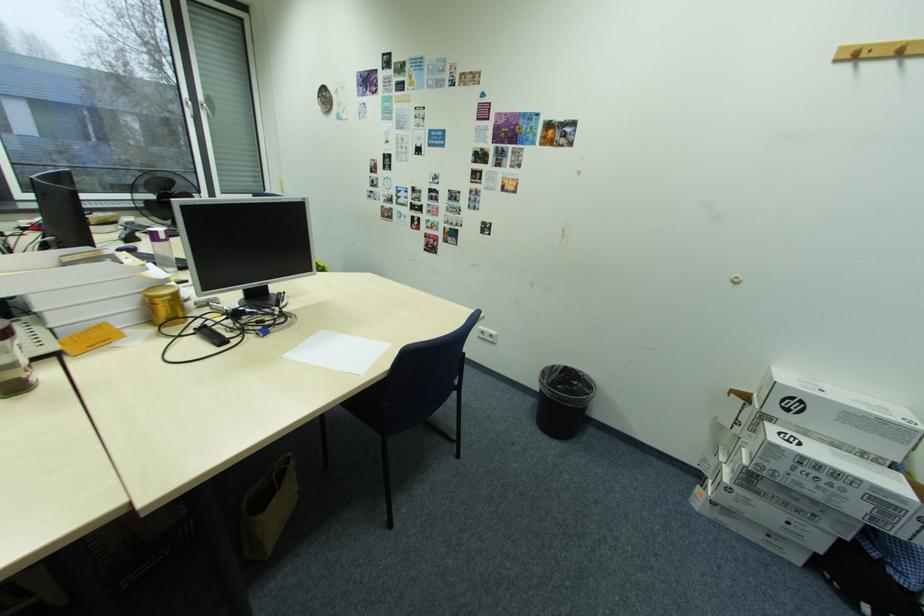
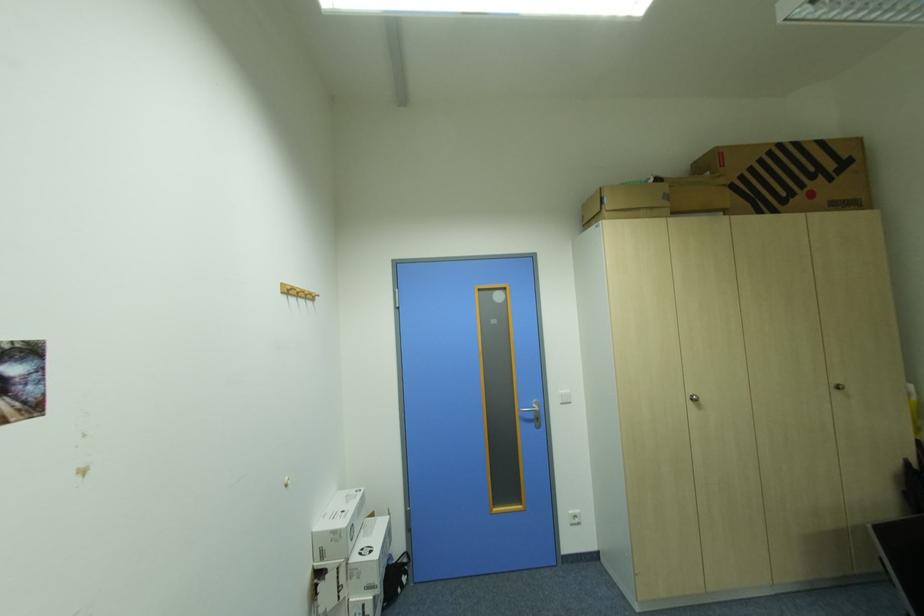
Question: I am providing you with two images of the same scene from different viewpoints. Which of the following objects are not visible in image2?

Choices:
 (A) large cardboard box
 (B) white paper box
 (C) silver cabinet handle
 (D) none of these

Answer: (D)